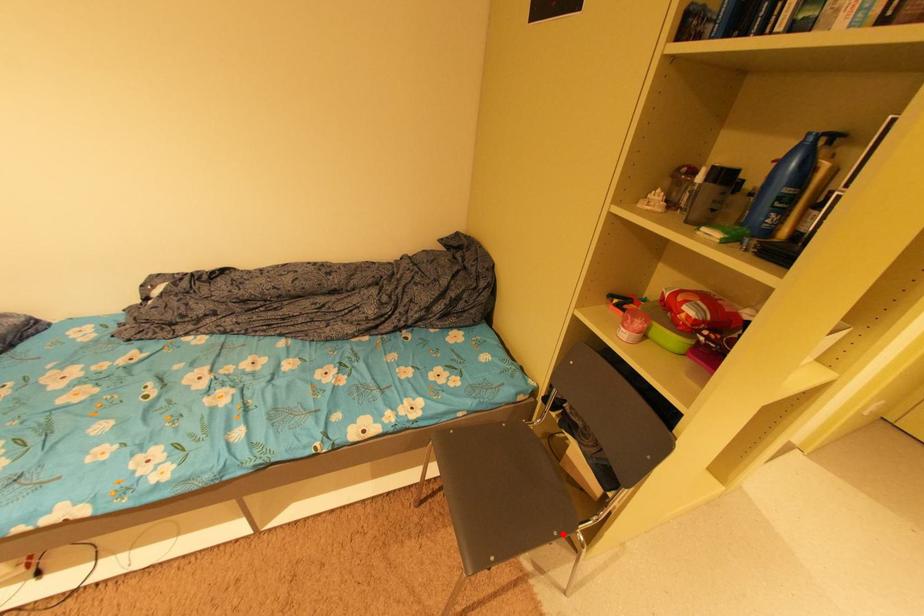
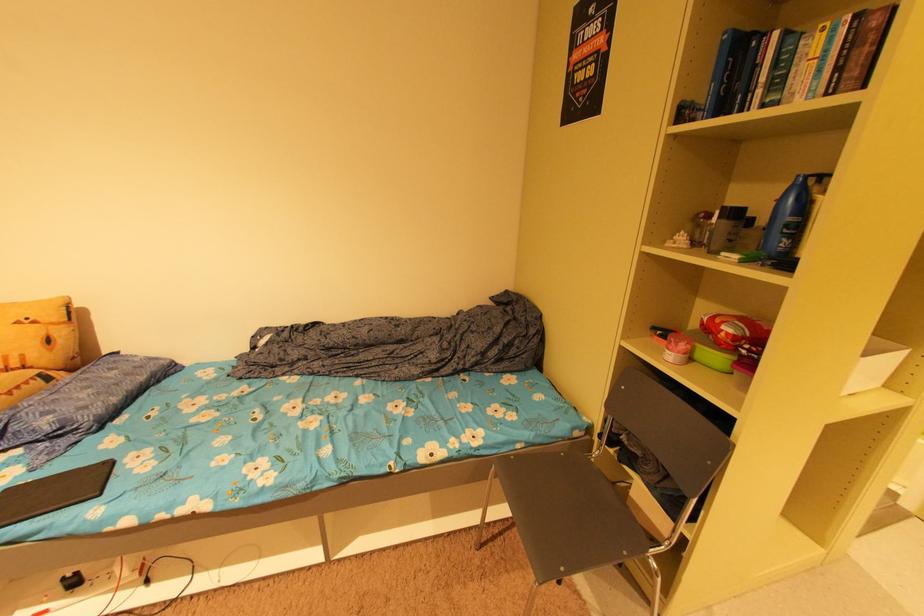
Where in the second image is the point corresponding to the highlighted location from the first image?

(633, 554)